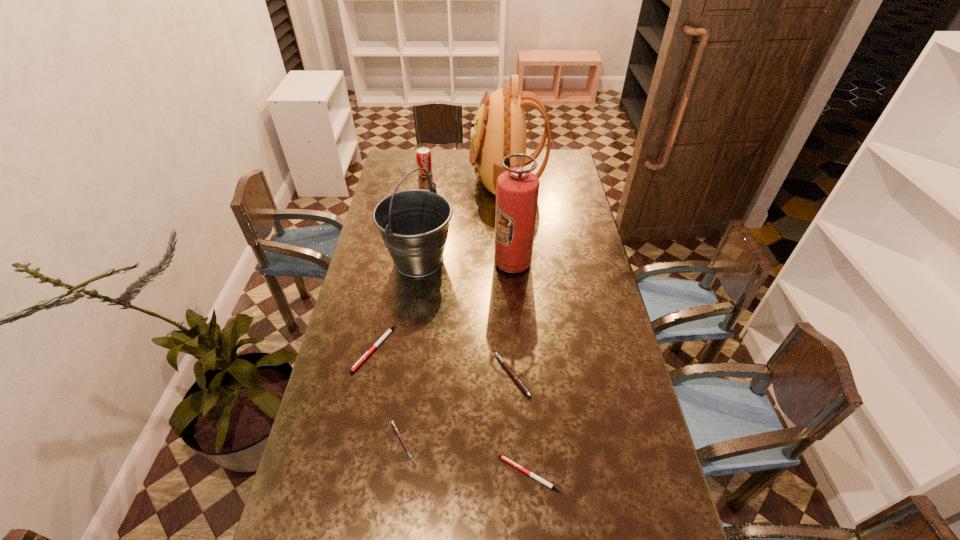
Locate which white pen is the closest to the third pen from right to left. Please provide its 2D coordinates. Your answer should be formatted as a tuple, i.e. [(x, y)], where the tuple contains the x and y coordinates of a point satisfying the conditions above.

[(388, 331)]